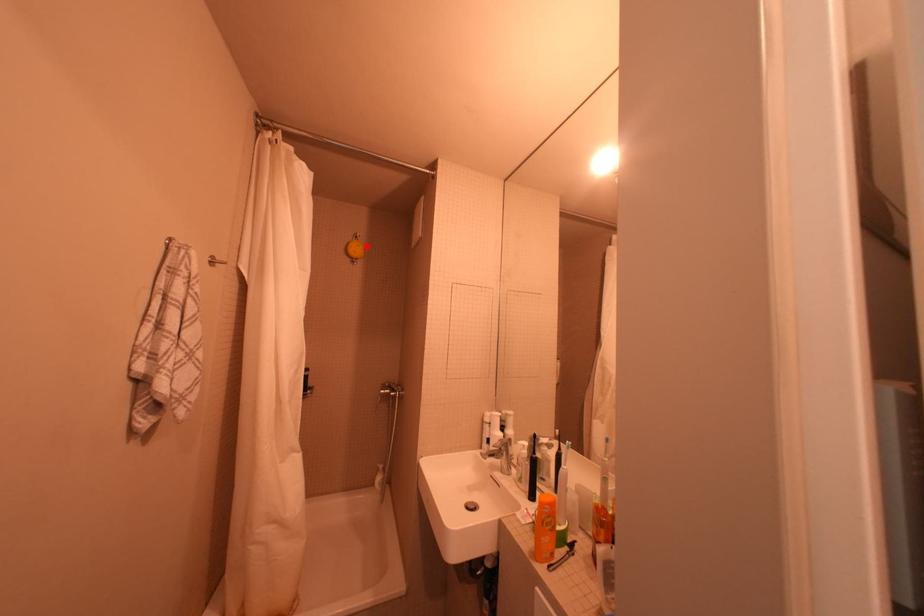
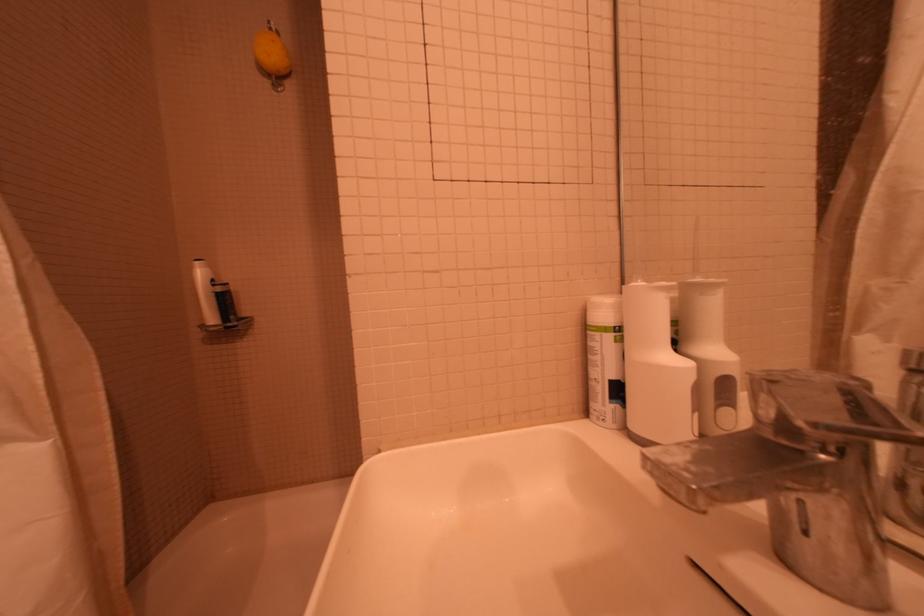
The point at the highlighted location is marked in the first image. Where is the corresponding point in the second image?

(281, 42)